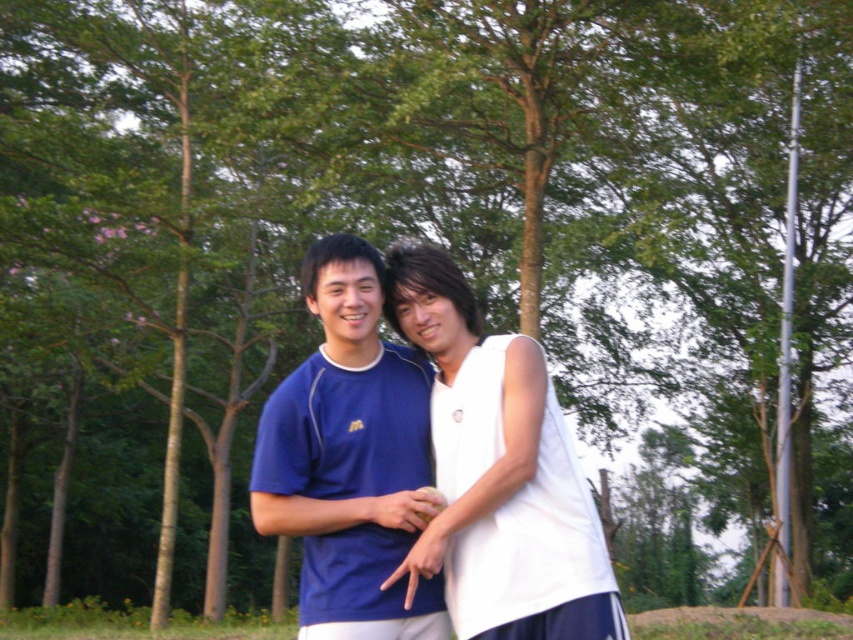
You are a photographer trying to capture a photo of both the white matte tank top at center and the matte blue shirt at center. Since you can only focus on one person at a time, which one should you focus on first if you want to ensure both are in the frame without moving the camera?

You should focus on the matte blue shirt at center first because the white matte tank top at center is to the right of it, so by centering the matte blue shirt at center, the white matte tank top at center will naturally be included in the frame to its right.

You are a photographer trying to capture a clear photo of the person wearing the white matte tank top at center. Since the person wearing the matte blue shirt at center is blocking the view, can you adjust your position to take the photo without the blue shirt wearer obstructing the view?

The white matte tank top at center is in front of the matte blue shirt at center, so you can adjust your position slightly to the side to capture the white matte tank top at center without the matte blue shirt at center blocking the view.